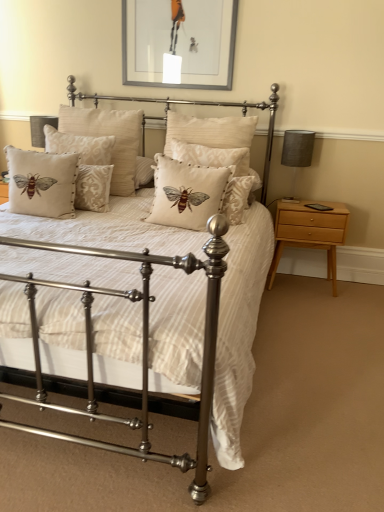
Question: Is beige fabric cushion with embroidered bee at left, which ranks as the fifth pillow in right-to-left order, positioned with its back to beige fabric cushion with embroidered bee at center, the second pillow in the right-to-left sequence?

Choices:
 (A) yes
 (B) no

Answer: (B)

Question: From a real-world perspective, does beige fabric cushion with embroidered bee at left, positioned as the 1th pillow in left-to-right order, stand above beige fabric cushion with embroidered bee at center, positioned as the 4th pillow in left-to-right order?

Choices:
 (A) no
 (B) yes

Answer: (B)

Question: From a real-world perspective, is beige fabric cushion with embroidered bee at left, which ranks as the fifth pillow in right-to-left order, positioned under beige fabric cushion with embroidered bee at center, the second pillow in the right-to-left sequence, based on gravity?

Choices:
 (A) yes
 (B) no

Answer: (B)

Question: Is the depth of beige fabric cushion with embroidered bee at left, positioned as the 1th pillow in left-to-right order, greater than that of beige fabric cushion with embroidered bee at center, positioned as the 4th pillow in left-to-right order?

Choices:
 (A) no
 (B) yes

Answer: (A)

Question: Is beige fabric cushion with embroidered bee at left, positioned as the 1th pillow in left-to-right order, outside beige fabric cushion with embroidered bee at center, the second pillow in the right-to-left sequence?

Choices:
 (A) no
 (B) yes

Answer: (B)

Question: Is matte silver bed at center bigger or smaller than beige fabric cushion with bee design at center, the third pillow when ordered from right to left?

Choices:
 (A) big
 (B) small

Answer: (A)

Question: Is matte silver bed at center wider or thinner than beige fabric cushion with bee design at center, the 3th pillow when ordered from left to right?

Choices:
 (A) thin
 (B) wide

Answer: (B)

Question: Considering the positions of matte silver bed at center and beige fabric cushion with bee design at center, the 3th pillow when ordered from left to right, in the image, is matte silver bed at center taller or shorter than beige fabric cushion with bee design at center, the 3th pillow when ordered from left to right,?

Choices:
 (A) short
 (B) tall

Answer: (B)

Question: Relative to beige fabric cushion with bee design at center, the 3th pillow when ordered from left to right, is matte silver bed at center in front or behind?

Choices:
 (A) behind
 (B) front

Answer: (B)

Question: Is beige fabric cushion with embroidered bee at center, positioned as the fifth pillow in left-to-right order, taller or shorter than beige fabric cushion with embroidered bee at left, positioned as the 1th pillow in left-to-right order?

Choices:
 (A) short
 (B) tall

Answer: (B)

Question: From a real-world perspective, relative to beige fabric cushion with embroidered bee at left, which ranks as the fifth pillow in right-to-left order, is beige fabric cushion with embroidered bee at center, positioned as the fifth pillow in left-to-right order, vertically above or below?

Choices:
 (A) below
 (B) above

Answer: (B)

Question: Is beige fabric cushion with embroidered bee at center, positioned as the fifth pillow in left-to-right order, situated inside beige fabric cushion with embroidered bee at left, positioned as the 1th pillow in left-to-right order, or outside?

Choices:
 (A) outside
 (B) inside

Answer: (A)

Question: Is point (244, 182) closer or farther from the camera than point (24, 164)?

Choices:
 (A) closer
 (B) farther

Answer: (A)

Question: Would you say gray fabric lampshade at right is to the left or to the right of light wood/finish nightstand at right in the picture?

Choices:
 (A) right
 (B) left

Answer: (B)

Question: From the image's perspective, is gray fabric lampshade at right above or below light wood/finish nightstand at right?

Choices:
 (A) below
 (B) above

Answer: (B)